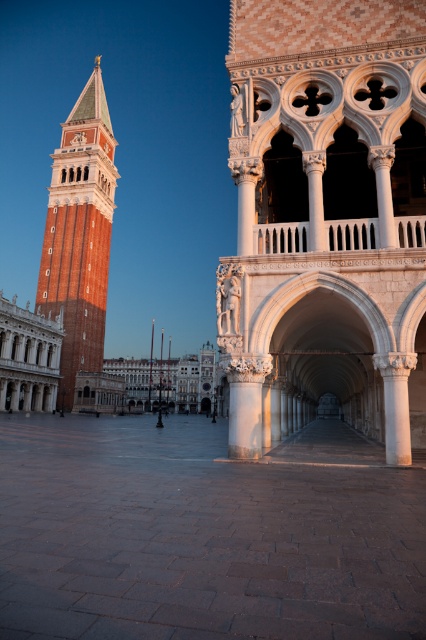
Question: Is white stone archway at center in front of white marble palace at left?

Choices:
 (A) yes
 (B) no

Answer: (A)

Question: Can you confirm if white stone archway at center is bigger than white marble palace at left?

Choices:
 (A) yes
 (B) no

Answer: (A)

Question: Which object is positioned closest to the white marble palace at center?

Choices:
 (A) white marble palace at left
 (B) white stone archway at center
 (C) red brick bell tower at left

Answer: (C)

Question: Which object appears farthest from the camera in this image?

Choices:
 (A) white stone archway at center
 (B) red brick bell tower at left

Answer: (B)

Question: Does white stone archway at center appear under white marble palace at center?

Choices:
 (A) no
 (B) yes

Answer: (A)

Question: Which point is closer to the camera?

Choices:
 (A) (57, 253)
 (B) (48, 358)
 (C) (147, 364)

Answer: (B)